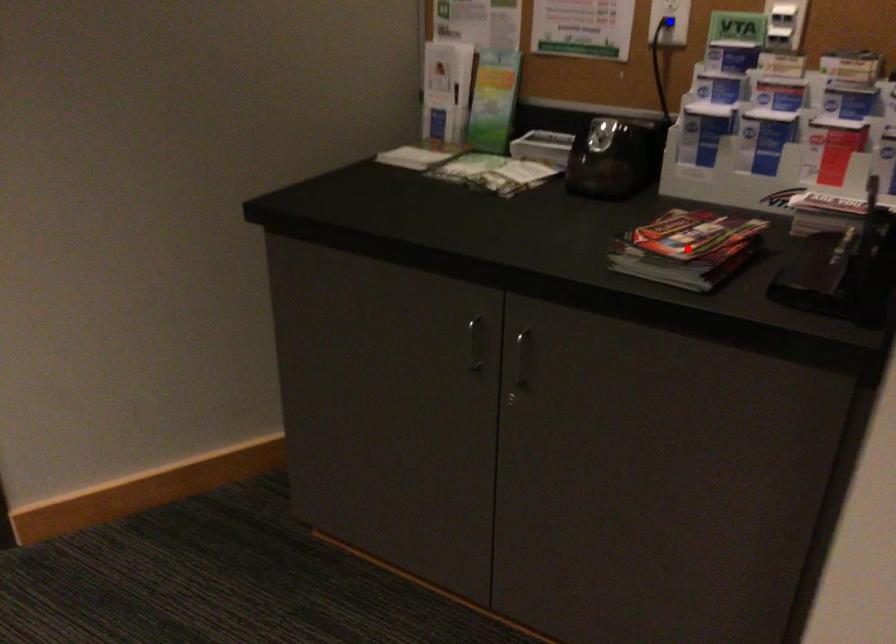
Question: In the image, two points are highlighted. Which point is nearer to the camera? Reply with the corresponding letter.

Choices:
 (A) blue point
 (B) red point

Answer: (B)